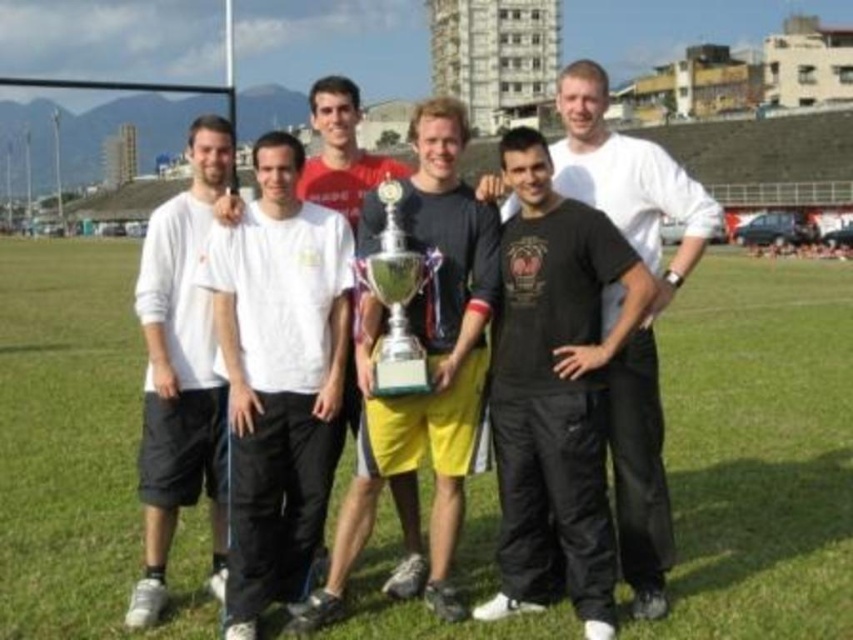
You are a photographer trying to capture a closeup shot of the trophy. You notice the green grass at center and the black matte pants at center are blocking your view. Which object should you move to get a clearer shot of the trophy?

The green grass at center has a larger width than the black matte pants at center, so you should move the green grass at center to get a clearer shot of the trophy.

From the picture: You are a photographer taking a picture of the group holding the trophy. You want to ensure the green grass at center and the black matte pants at center are both clearly visible. Which object should you focus on first to achieve this?

The green grass at center is in front of the black matte pants at center, so you should focus on the green grass at center first to ensure both are in focus.